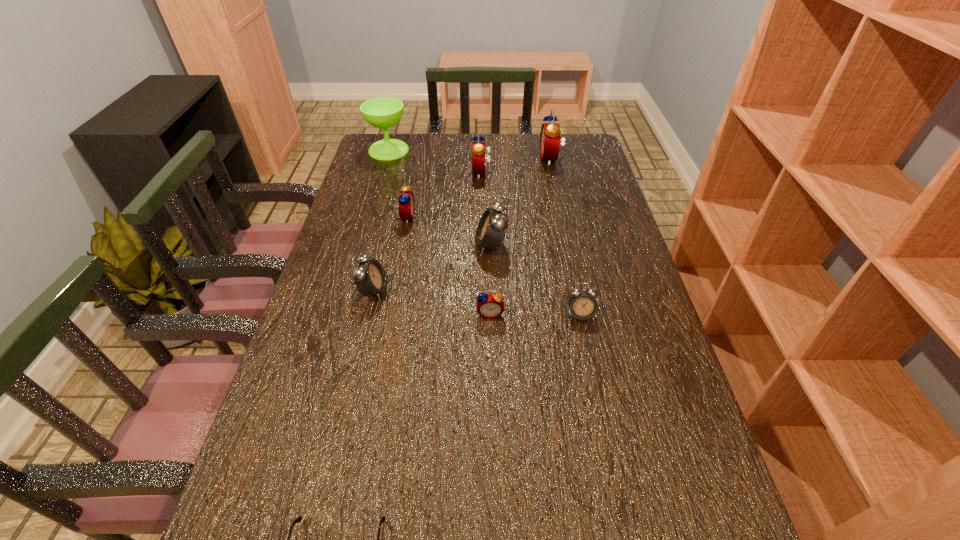
Where is `object located in the far left corner section of the desktop`? This screenshot has height=540, width=960. object located in the far left corner section of the desktop is located at coordinates (384, 112).

You are a GUI agent. You are given a task and a screenshot of the screen. Output one action in this format:
    pyautogui.click(x=<x>, y=<y>)
    Task: Click on the object that is at the far right corner
    The height and width of the screenshot is (540, 960).
    Given the screenshot: What is the action you would take?
    pyautogui.click(x=550, y=133)

This screenshot has width=960, height=540. In the image, there is a desktop. Find the location of `free region at the far edge`. free region at the far edge is located at coordinates (468, 161).

In the image, there is a desktop. Where is `free space at the left edge`? free space at the left edge is located at coordinates (322, 504).

At what (x,y) coordinates should I click in order to perform the action: click on vacant region at the right edge. Please return your answer as a coordinate pair (x, y). This screenshot has width=960, height=540. Looking at the image, I should click on (655, 505).

The width and height of the screenshot is (960, 540). Find the location of `free spot at the far right corner of the desktop`. free spot at the far right corner of the desktop is located at coordinates (565, 148).

The height and width of the screenshot is (540, 960). In order to click on empty space that is in between the nearest white alarm clock and the third smallest red alarm clock in this screenshot , I will do `click(531, 244)`.

Identify the location of vacant area between the third farthest alarm clock and the smallest white alarm clock. This screenshot has width=960, height=540. (493, 266).

Where is `unoccupied position between the nearest red alarm clock and the smallest white alarm clock`? Image resolution: width=960 pixels, height=540 pixels. unoccupied position between the nearest red alarm clock and the smallest white alarm clock is located at coordinates (536, 314).

Locate an element on the screen. This screenshot has width=960, height=540. free space that is in between the wineglass and the smallest red alarm clock is located at coordinates (440, 232).